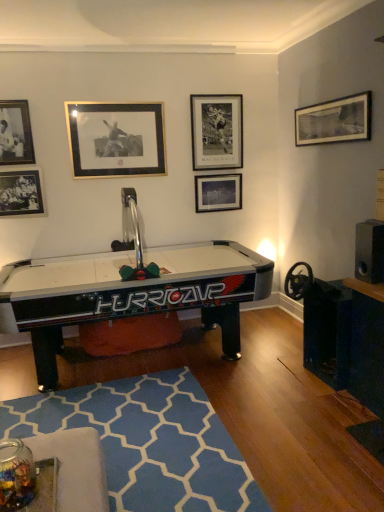
Question: From the image's perspective, is matte black picture frame at upper right, arranged as the sixth picture frame when viewed from the left, above or below black plastic air hockey table at center?

Choices:
 (A) above
 (B) below

Answer: (A)

Question: Is matte black picture frame at upper right, arranged as the sixth picture frame when viewed from the left, taller or shorter than black plastic air hockey table at center?

Choices:
 (A) tall
 (B) short

Answer: (B)

Question: Which object is positioned farthest from the black plastic air hockey table at center?

Choices:
 (A) black matte picture frame at lower left, which ranks as the 2th picture frame in left-to-right order
 (B) black plastic speaker at right
 (C) metallic silver picture frame at upper center, acting as the third picture frame starting from the right
 (D) matte black picture frame at upper left, the 6th picture frame from the right
 (E) matte black picture frame at upper right, arranged as the sixth picture frame when viewed from the left

Answer: (E)

Question: Which of these objects is positioned farthest from the matte black picture frame at upper left, the 6th picture frame from the right?

Choices:
 (A) matte black picture frame at center, arranged as the 5th picture frame when viewed from the left
 (B) matte black picture frame at upper right, the 1th picture frame positioned from the right
 (C) gold-framed print at upper center, marked as the fourth picture frame in a right-to-left arrangement
 (D) black plastic air hockey table at center
 (E) blue fabric rug at lower center

Answer: (B)